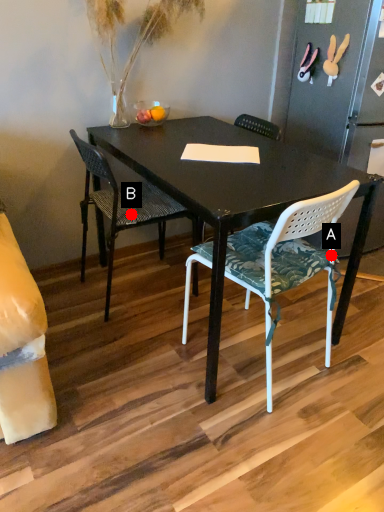
Question: Two points are circled on the image, labeled by A and B beside each circle. Which point is closer to the camera?

Choices:
 (A) A is closer
 (B) B is closer

Answer: (A)